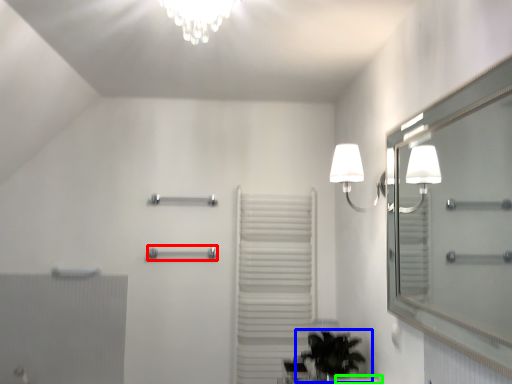
Question: Which is nearer to the towel bar (highlighted by a red box)? houseplant (highlighted by a blue box) or counter top (highlighted by a green box).

Choices:
 (A) houseplant
 (B) counter top

Answer: (A)